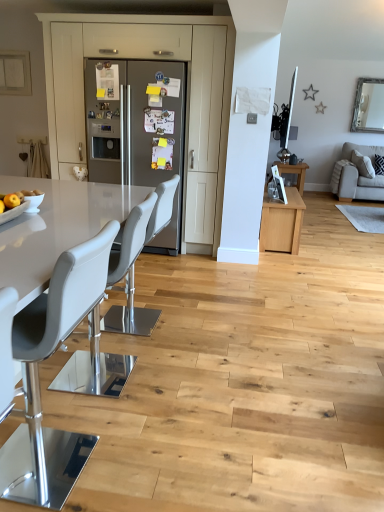
Question: Is satin stainless steel refrigerator at center to the right of white leather chair at center, positioned as the 3th chair in front-to-back order, from the viewer's perspective?

Choices:
 (A) no
 (B) yes

Answer: (A)

Question: Does satin stainless steel refrigerator at center have a lesser width compared to white leather chair at center, positioned as the 3th chair in front-to-back order?

Choices:
 (A) no
 (B) yes

Answer: (A)

Question: Is satin stainless steel refrigerator at center bigger than white leather chair at center, the 1th chair viewed from the back?

Choices:
 (A) no
 (B) yes

Answer: (B)

Question: Can you confirm if satin stainless steel refrigerator at center is smaller than white leather chair at center, positioned as the 3th chair in front-to-back order?

Choices:
 (A) yes
 (B) no

Answer: (B)

Question: Is satin stainless steel refrigerator at center not inside white leather chair at center, positioned as the 3th chair in front-to-back order?

Choices:
 (A) no
 (B) yes

Answer: (B)

Question: Is matte gray cabinet at center in front of or behind wooden table at center in the image?

Choices:
 (A) behind
 (B) front

Answer: (B)

Question: Would you say matte gray cabinet at center is to the left or to the right of wooden table at center in the picture?

Choices:
 (A) right
 (B) left

Answer: (B)

Question: Is point (130, 46) positioned closer to the camera than point (289, 166)?

Choices:
 (A) closer
 (B) farther

Answer: (A)

Question: Based on their sizes in the image, would you say matte gray cabinet at center is bigger or smaller than wooden table at center?

Choices:
 (A) big
 (B) small

Answer: (A)

Question: Based on their sizes in the image, would you say white leather chair at center, the 1th chair viewed from the back, is bigger or smaller than satin stainless steel refrigerator at center?

Choices:
 (A) small
 (B) big

Answer: (A)

Question: From the image's perspective, is white leather chair at center, the 1th chair viewed from the back, located above or below satin stainless steel refrigerator at center?

Choices:
 (A) below
 (B) above

Answer: (A)

Question: Considering the positions of white leather chair at center, positioned as the 3th chair in front-to-back order, and satin stainless steel refrigerator at center in the image, is white leather chair at center, positioned as the 3th chair in front-to-back order, wider or thinner than satin stainless steel refrigerator at center?

Choices:
 (A) thin
 (B) wide

Answer: (A)

Question: From their relative heights in the image, would you say white leather chair at center, the 1th chair viewed from the back, is taller or shorter than satin stainless steel refrigerator at center?

Choices:
 (A) short
 (B) tall

Answer: (A)

Question: From a real-world perspective, is white leather chair at center, positioned as the 3th chair in front-to-back order, positioned above or below matte gray cabinet at center?

Choices:
 (A) below
 (B) above

Answer: (A)

Question: Considering the positions of white leather chair at center, positioned as the 3th chair in front-to-back order, and matte gray cabinet at center in the image, is white leather chair at center, positioned as the 3th chair in front-to-back order, wider or thinner than matte gray cabinet at center?

Choices:
 (A) wide
 (B) thin

Answer: (B)